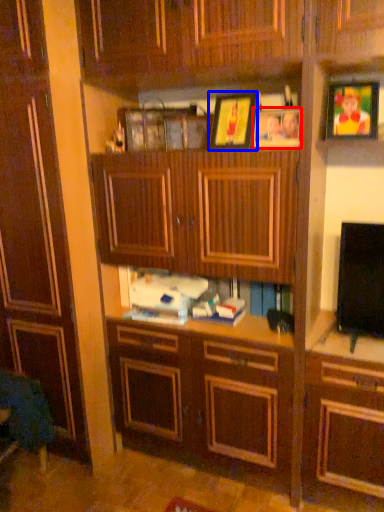
Question: Which point is further to the camera, picture frame (highlighted by a red box) or picture frame (highlighted by a blue box)?

Choices:
 (A) picture frame
 (B) picture frame

Answer: (B)